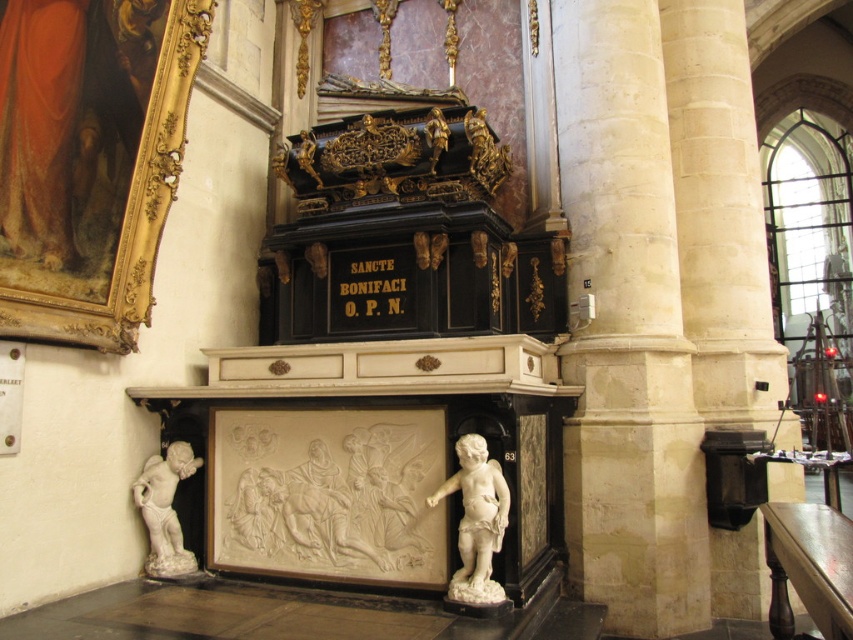
Is white marble cherub at lower right thinner than white marble cherub at lower left?

In fact, white marble cherub at lower right might be wider than white marble cherub at lower left.

What do you see at coordinates (476, 518) in the screenshot?
I see `white marble cherub at lower right` at bounding box center [476, 518].

The width and height of the screenshot is (853, 640). Find the location of `white marble cherub at lower right`. white marble cherub at lower right is located at coordinates (476, 518).

Does point (509, 541) come behind point (474, 500)?

Yes, it is behind point (474, 500).

Where is `white marble fireplace at center`? The height and width of the screenshot is (640, 853). white marble fireplace at center is located at coordinates (370, 458).

Is point (320, 579) closer to viewer compared to point (462, 518)?

No, it is not.

Locate an element on the screen. Image resolution: width=853 pixels, height=640 pixels. white marble fireplace at center is located at coordinates (370, 458).

Which is below, white marble fireplace at center or white marble cherub at lower left?

white marble cherub at lower left

Is point (225, 480) farther from viewer compared to point (173, 509)?

No, it is in front of (173, 509).

Locate an element on the screen. white marble fireplace at center is located at coordinates (370, 458).